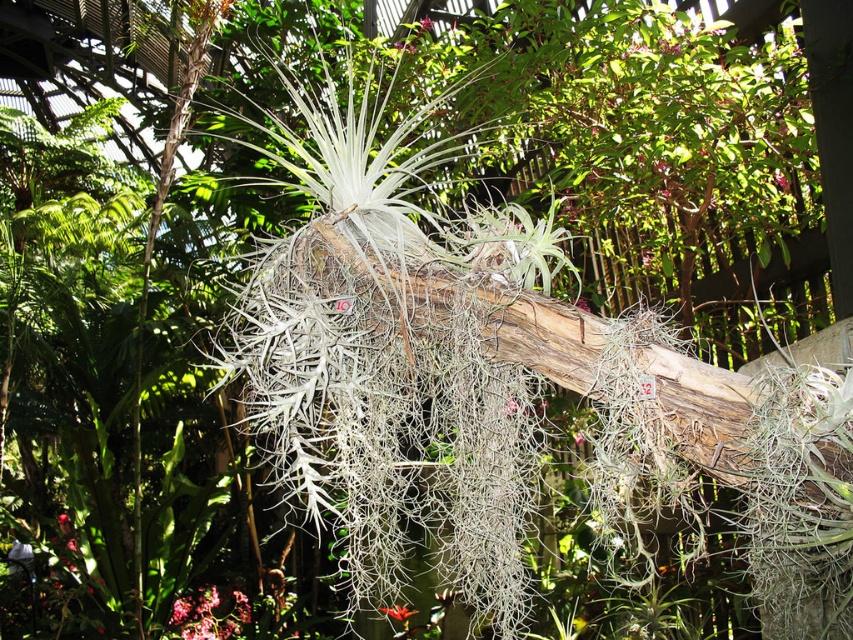
Question: Considering the relative positions of pink matte flower at lower left and orange matte flower at center in the image provided, where is pink matte flower at lower left located with respect to orange matte flower at center?

Choices:
 (A) above
 (B) below

Answer: (B)

Question: Which of the following is the closest to the observer?

Choices:
 (A) orange matte flower at center
 (B) pink matte flower at lower left

Answer: (A)

Question: Can you confirm if pink matte flower at lower left is positioned to the right of orange matte flower at center?

Choices:
 (A) yes
 (B) no

Answer: (B)

Question: Which object appears farthest from the camera in this image?

Choices:
 (A) pink matte flower at lower left
 (B) orange matte flower at center

Answer: (A)

Question: Can you confirm if pink matte flower at lower left is positioned to the right of orange matte flower at center?

Choices:
 (A) no
 (B) yes

Answer: (A)

Question: Which point is farther to the camera?

Choices:
 (A) (416, 611)
 (B) (183, 636)

Answer: (B)